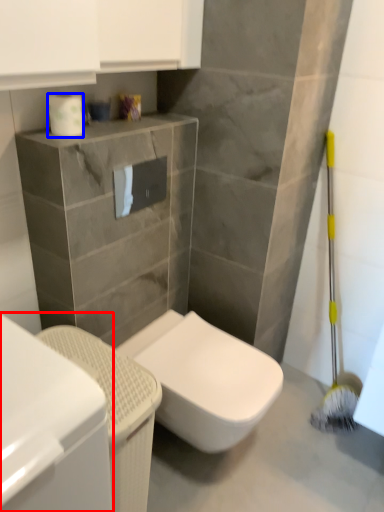
Question: Which object is closer to the camera taking this photo, cabinetry (highlighted by a red box) or toilet paper (highlighted by a blue box)?

Choices:
 (A) cabinetry
 (B) toilet paper

Answer: (A)